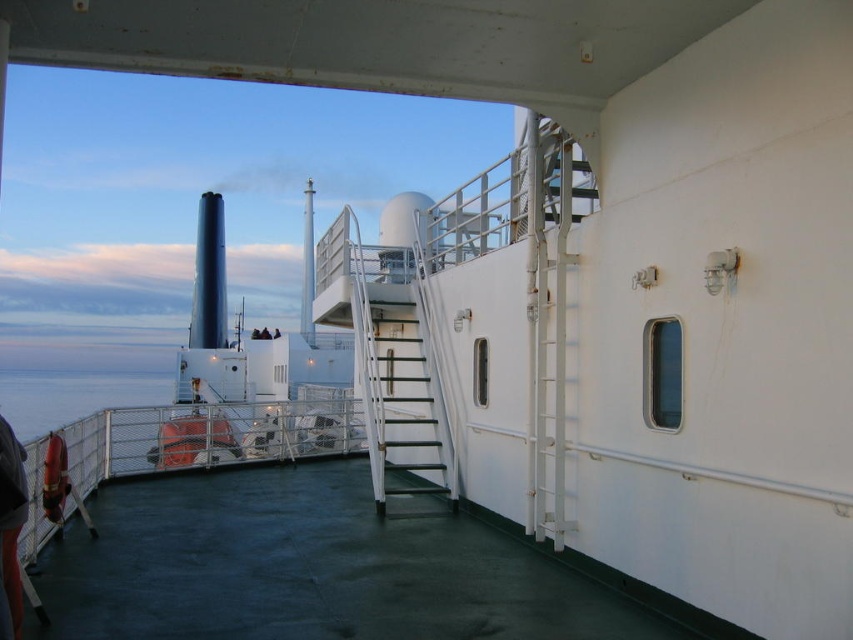
You are standing on the ship deck and need to locate the green rubber deck at center. According to the coordinates provided, where exactly is it positioned?

The green rubber deck at center is located at coordinates point (x=310, y=566).